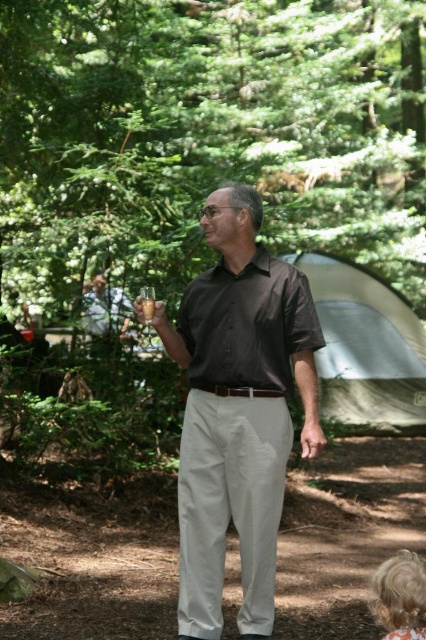
You are a photographer trying to capture a portrait of the man in the scene. Since the matte black shirt at center and the blonde hair at lower right are both visible in the frame, which one should you focus on to ensure proper exposure, considering their size differences?

The matte black shirt at center has a larger size compared to blonde hair at lower right, so you should focus on the matte black shirt at center for proper exposure as it occupies more of the frame.

You are a hiker who wants to set up a tent in this forest area. You see the green leafy tree at upper center and the gray fabric tent at center. Which object is located above the other?

The green leafy tree at upper center is positioned over gray fabric tent at center.

You are a photographer positioned 3 meters away from the matte black shirt at center. Can you capture the entire scene in one shot without moving closer or further away?

A: The matte black shirt at center is 4.00 meters away from the viewer. Since you are positioned 3 meters away, you are closer than the required distance, so moving back to 4 meters would be needed to capture the entire scene. However, since you cannot move further away, you might need a wider lens to include the entire scene in one shot.